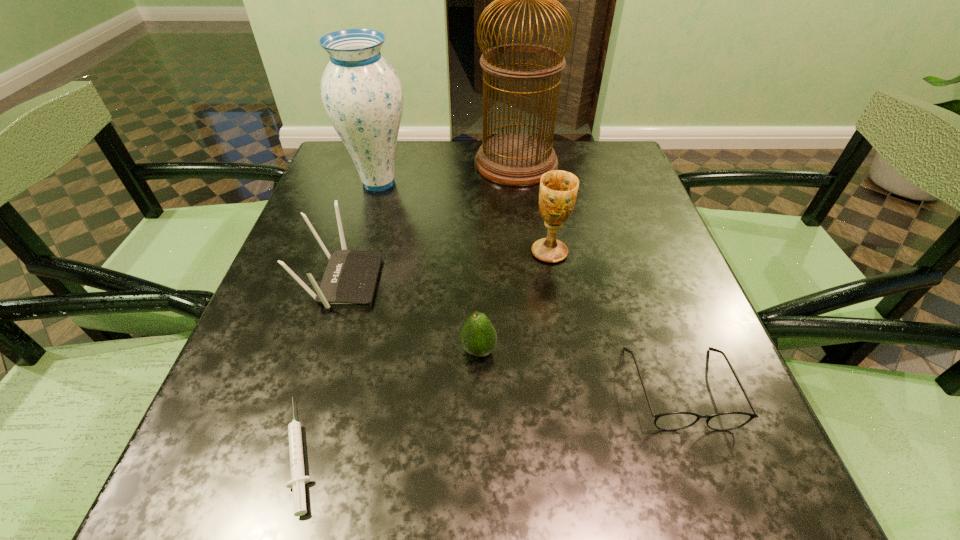
Find the location of a particular element. vase that is at the left edge is located at coordinates (362, 95).

Locate an element on the screen. The image size is (960, 540). router located at the left edge is located at coordinates (350, 277).

At what (x,y) coordinates should I click in order to perform the action: click on syringe present at the left edge. Please return your answer as a coordinate pair (x, y). This screenshot has width=960, height=540. Looking at the image, I should click on (298, 480).

Identify the location of object situated at the right edge. The width and height of the screenshot is (960, 540). (671, 421).

You are a GUI agent. You are given a task and a screenshot of the screen. Output one action in this format:
    pyautogui.click(x=<x>, y=<y>)
    Task: Click on the object located at the far left corner
    The height and width of the screenshot is (540, 960).
    Given the screenshot: What is the action you would take?
    pyautogui.click(x=362, y=95)

Image resolution: width=960 pixels, height=540 pixels. Find the location of `object that is at the near left corner`. object that is at the near left corner is located at coordinates (298, 480).

This screenshot has height=540, width=960. Find the location of `free spot at the far edge of the desktop`. free spot at the far edge of the desktop is located at coordinates (412, 145).

At what (x,y) coordinates should I click in order to perform the action: click on vacant point at the near edge. Please return your answer as a coordinate pair (x, y). The height and width of the screenshot is (540, 960). Looking at the image, I should click on (543, 501).

In the image, there is a desktop. Where is `blank space at the left edge`? blank space at the left edge is located at coordinates (313, 383).

In the image, there is a desktop. Where is `free space at the right edge`? The width and height of the screenshot is (960, 540). free space at the right edge is located at coordinates (704, 388).